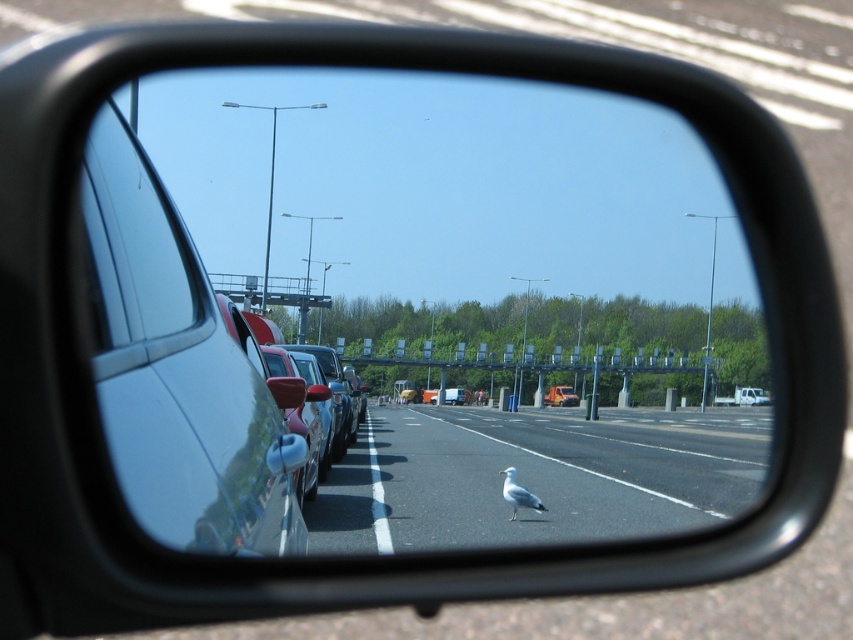
Question: Can you confirm if glossy metallic car window at left is positioned below clear glass car window at left?

Choices:
 (A) no
 (B) yes

Answer: (B)

Question: Which object is farther from the camera taking this photo?

Choices:
 (A) glossy metallic mirror at center
 (B) white matte bird at center
 (C) smooth asphalt highway at center
 (D) clear glass car window at left

Answer: (B)

Question: Is glossy metallic mirror at center smaller than glossy metallic car window at left?

Choices:
 (A) no
 (B) yes

Answer: (A)

Question: Among these points, which one is farthest from the camera?

Choices:
 (A) (265, 470)
 (B) (155, 324)
 (C) (148, 244)
 (D) (537, 504)

Answer: (D)

Question: Which of these objects is positioned farthest from the white matte bird at center?

Choices:
 (A) clear glass car window at left
 (B) glossy metallic car window at left
 (C) glossy metallic mirror at center
 (D) smooth asphalt highway at center

Answer: (C)

Question: Can you confirm if glossy metallic mirror at center is bigger than glossy metallic car window at left?

Choices:
 (A) no
 (B) yes

Answer: (B)